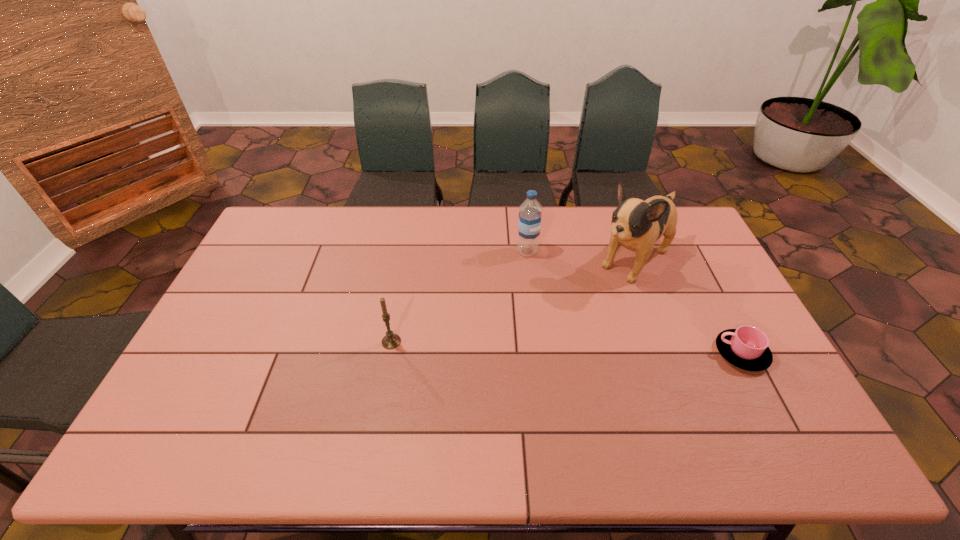
Locate an element on the screen. The height and width of the screenshot is (540, 960). vacant space on the desktop that is between the leftmost object and the shortest object and is positioned at the face of the puppy is located at coordinates (537, 347).

You are a GUI agent. You are given a task and a screenshot of the screen. Output one action in this format:
    pyautogui.click(x=<x>, y=<y>)
    Task: Click on the free space on the desktop that is between the leftmost object and the cup and is positioned on the label of the water bottle
    Image resolution: width=960 pixels, height=540 pixels.
    Given the screenshot: What is the action you would take?
    pyautogui.click(x=603, y=349)